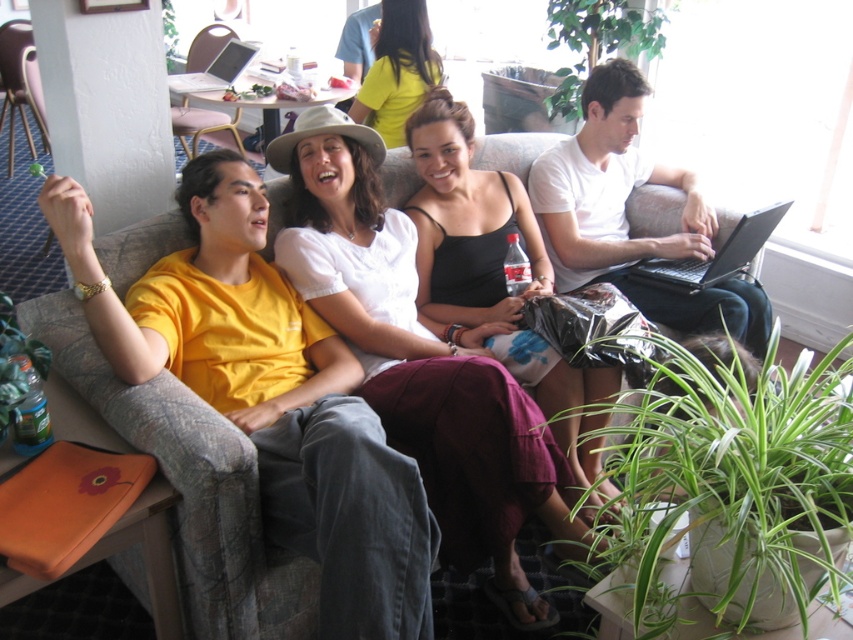
Question: Does gray fabric couch at center have a larger size compared to matte yellow shirt at center?

Choices:
 (A) yes
 (B) no

Answer: (A)

Question: Which point is farther from the camera taking this photo?

Choices:
 (A) (512, 346)
 (B) (158, 257)

Answer: (A)

Question: Which of the following is the closest to the observer?

Choices:
 (A) matte yellow shirt at center
 (B) white cotton shirt at center
 (C) black satin dress at center

Answer: (B)

Question: Estimate the real-world distances between objects in this image. Which object is closer to the white cotton shirt at center?

Choices:
 (A) silver metallic laptop at upper left
 (B) matte yellow shirt at center
 (C) black plastic laptop at right

Answer: (C)

Question: Does gray fabric couch at center come behind matte yellow shirt at center?

Choices:
 (A) yes
 (B) no

Answer: (B)

Question: Does black satin dress at center have a greater width compared to black plastic laptop at right?

Choices:
 (A) no
 (B) yes

Answer: (B)